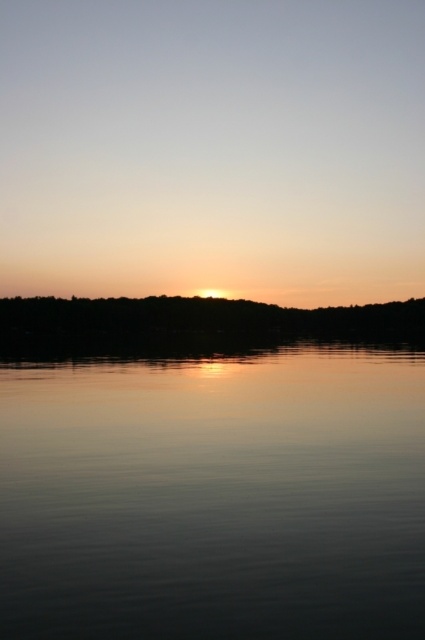
You are standing on the shore of the lake and see the smooth water at center and the golden reflective sky at center. Which one is positioned to the left from your perspective?

The smooth water at center is positioned to the left of the golden reflective sky at center.

You are an artist trying to paint the sunset scene. You notice the smooth water at center and the golden reflective sky at center. Which one takes up more area in the image?

The golden reflective sky at center occupies more space than the smooth water at center.